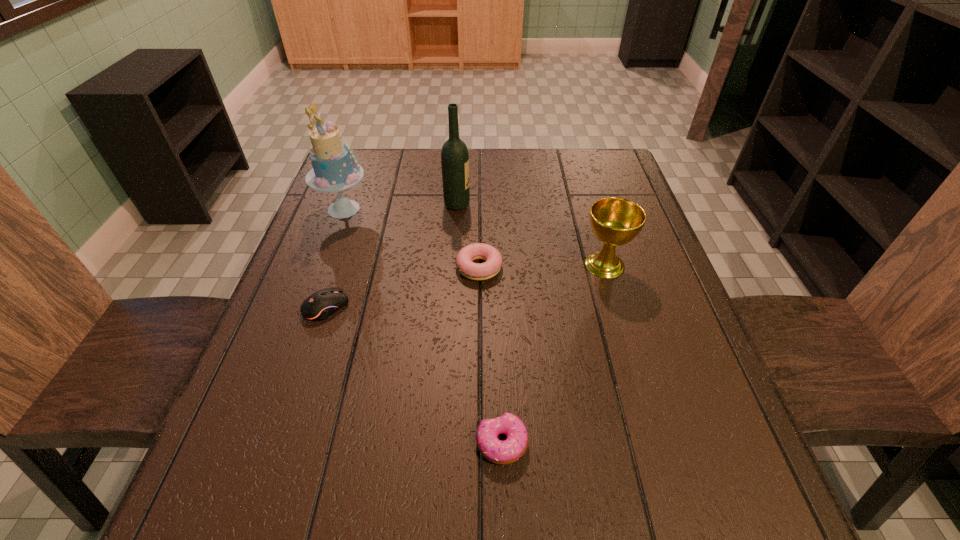
At what (x,y) coordinates should I click in order to perform the action: click on free space between the wine bottle and the computer mouse. Please return your answer as a coordinate pair (x, y). The image size is (960, 540). Looking at the image, I should click on [x=392, y=256].

Identify which object is located as the fifth nearest to the farther doughnut. Please provide its 2D coordinates. Your answer should be formatted as a tuple, i.e. [(x, y)], where the tuple contains the x and y coordinates of a point satisfying the conditions above.

[(505, 452)]

Point out which object is positioned as the third nearest to the farther doughnut. Please provide its 2D coordinates. Your answer should be formatted as a tuple, i.e. [(x, y)], where the tuple contains the x and y coordinates of a point satisfying the conditions above.

[(322, 304)]

Locate an element on the screen. The image size is (960, 540). blank space that satisfies the following two spatial constraints: 1. with a ladder on the side of the nearer doughnut; 2. on the right side of the cake is located at coordinates (258, 443).

Image resolution: width=960 pixels, height=540 pixels. Identify the location of vacant area that satisfies the following two spatial constraints: 1. with a ladder on the side of the cake; 2. on the right side of the computer mouse. (308, 307).

The height and width of the screenshot is (540, 960). I want to click on vacant area in the image that satisfies the following two spatial constraints: 1. with a ladder on the side of the cake; 2. on the right side of the farther doughnut, so click(x=323, y=267).

Find the location of a particular element. The image size is (960, 540). vacant area that satisfies the following two spatial constraints: 1. with a ladder on the side of the cake; 2. on the right side of the computer mouse is located at coordinates (308, 307).

This screenshot has width=960, height=540. I want to click on blank area in the image that satisfies the following two spatial constraints: 1. on the labeled side of the wine bottle; 2. on the left side of the farther doughnut, so click(453, 267).

Identify the location of vacant space that satisfies the following two spatial constraints: 1. on the back side of the computer mouse; 2. on the left side of the farther doughnut. The width and height of the screenshot is (960, 540). (340, 267).

The image size is (960, 540). I want to click on vacant space that satisfies the following two spatial constraints: 1. on the labeled side of the wine bottle; 2. on the back side of the nearest object, so click(443, 443).